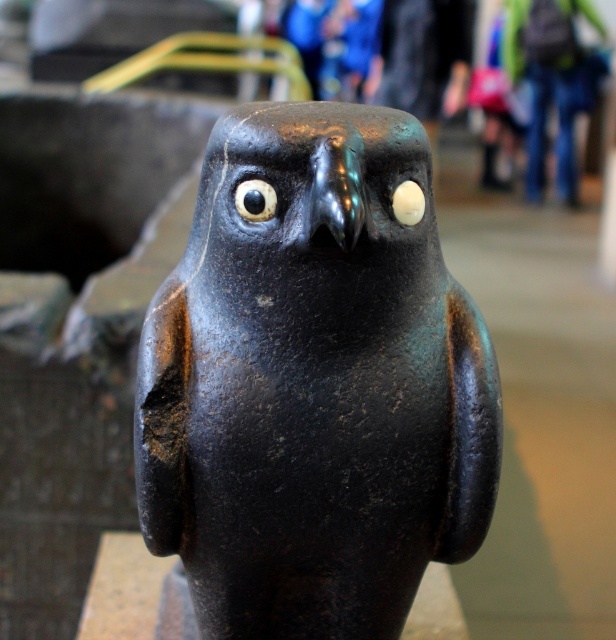
You are a sculptor who needs to place a 5 inch long tool between the matte black bird at center and the black glossy eye at center. Will the tool fit between them?

The distance between the matte black bird at center and the black glossy eye at center is 4.99 inches, so the 5 inch tool will not fit between them as it is slightly longer than the available space.